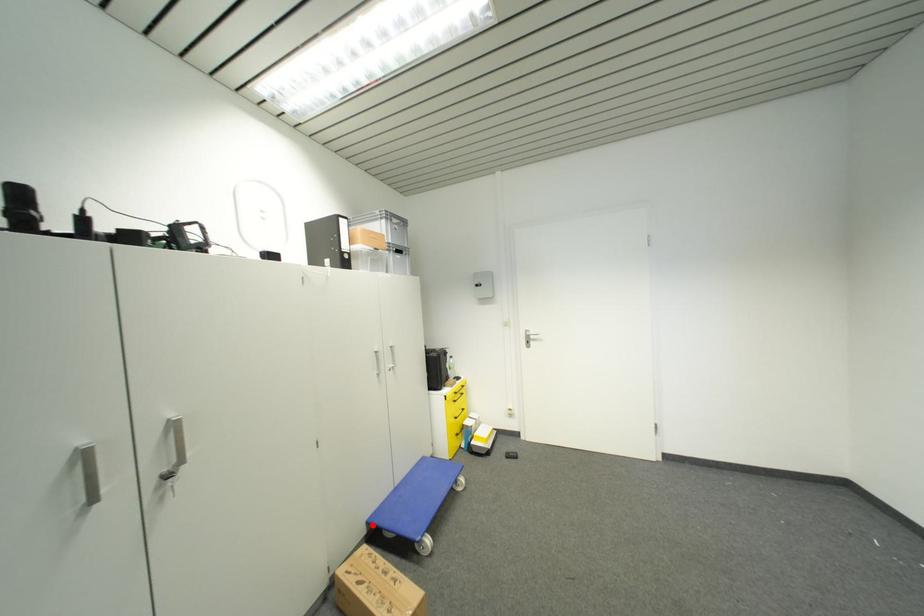
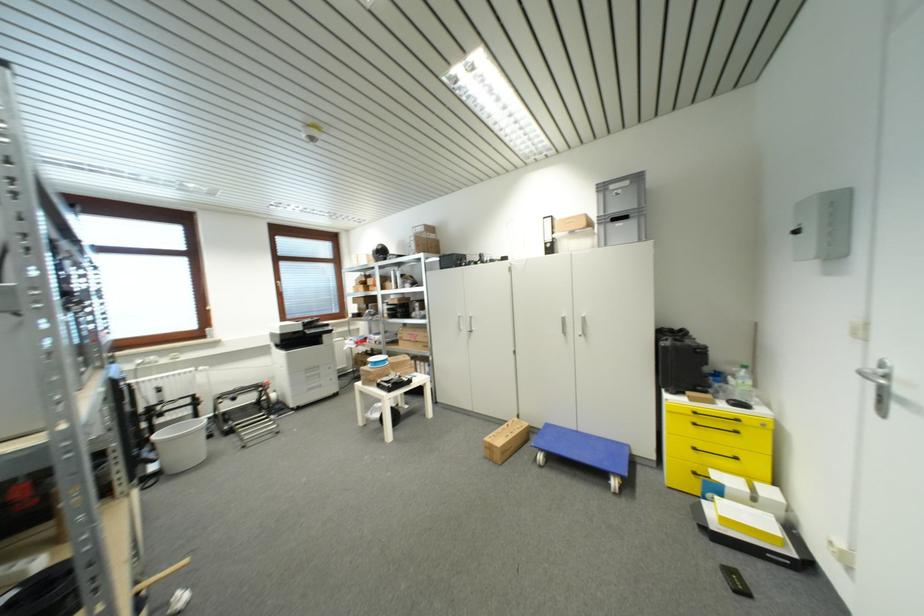
Question: I am providing you with two images of the same scene from different viewpoints. A red point is shown in image1. For the corresponding object point in image2, is it positioned nearer or farther from the camera?

Choices:
 (A) Nearer
 (B) Farther

Answer: (A)